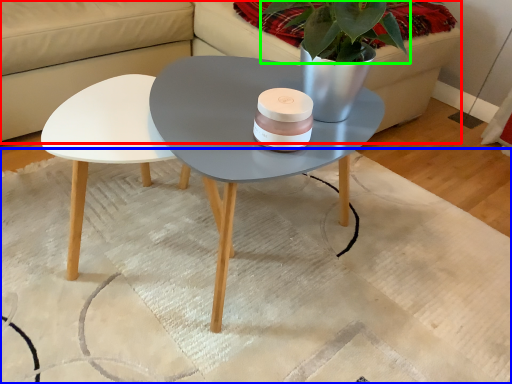
Question: Estimate the real-world distances between objects in this image. Which object is farther from couch (highlighted by a red box), mat (highlighted by a blue box) or plant (highlighted by a green box)?

Choices:
 (A) mat
 (B) plant

Answer: (B)